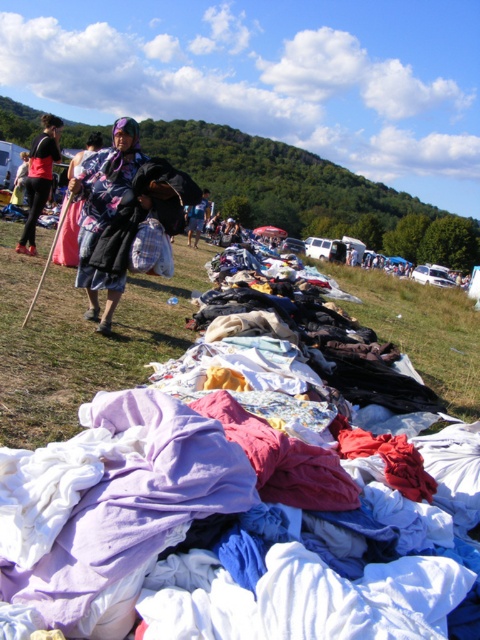
You are standing at the center of the image and want to walk towards the green grass at left. Which direction should you move?

You should move to the left to reach the green grass at left, as its position is at point (81, 339), which is located on the left side of the image.

You are standing at the point labeled point (411, 294) and want to walk to the point labeled point (192, 339). Which direction should you move to get closer to your destination?

You should move towards the camera because point (192, 339) is closer to the camera than point (411, 294).